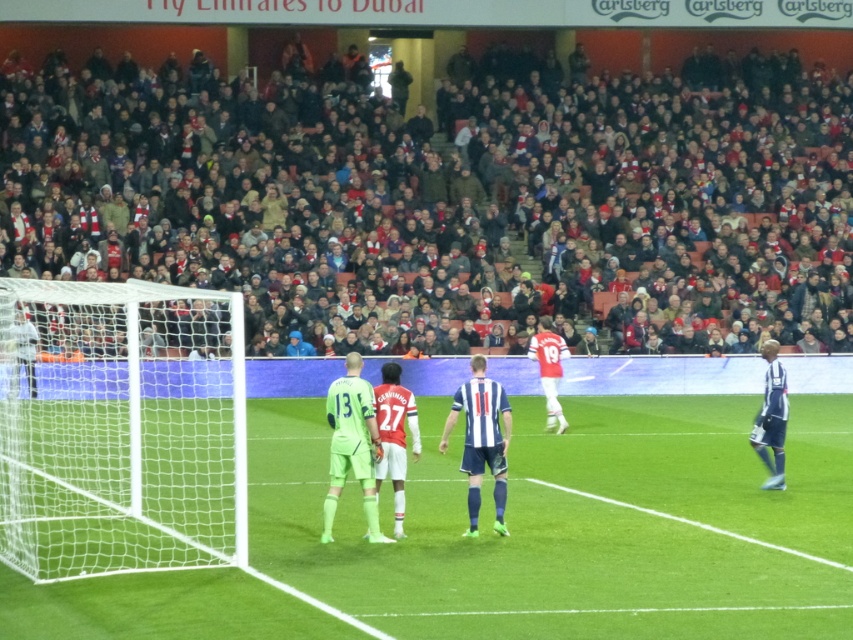
Question: Can you confirm if green artificial turf at center is positioned to the left of white mesh net at left?

Choices:
 (A) yes
 (B) no

Answer: (B)

Question: Can you confirm if striped jersey at center is positioned below blue jersey at right?

Choices:
 (A) yes
 (B) no

Answer: (A)

Question: Which point is farther to the camera?

Choices:
 (A) (358, 452)
 (B) (749, 474)
 (C) (73, 470)
 (D) (749, 440)

Answer: (B)

Question: Which of the following is the closest to the observer?

Choices:
 (A) (665, 516)
 (B) (467, 529)
 (C) (766, 486)

Answer: (B)

Question: From the image, what is the correct spatial relationship of green artificial turf at center in relation to blue jersey at right?

Choices:
 (A) above
 (B) below

Answer: (B)

Question: Which of these objects is positioned closest to the green artificial turf at center?

Choices:
 (A) striped jersey at center
 (B) white mesh net at left

Answer: (B)